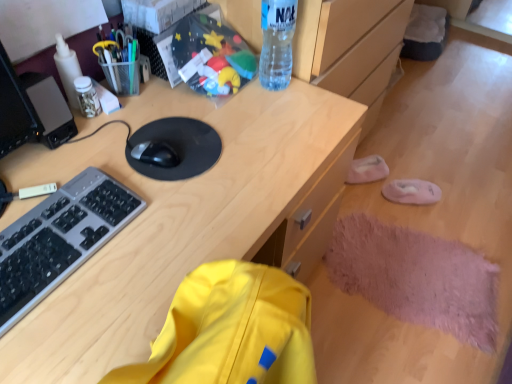
In order to click on free space that is in between gray plastic keyboard at left and black matte mousepad at center in this screenshot , I will do `click(130, 221)`.